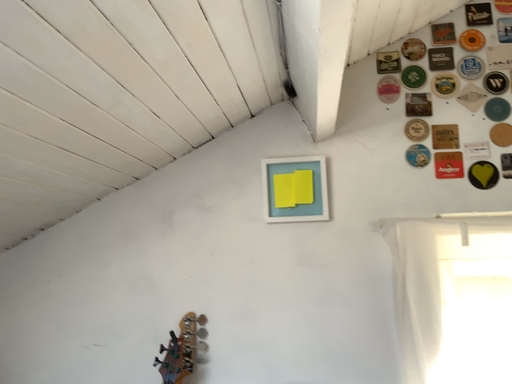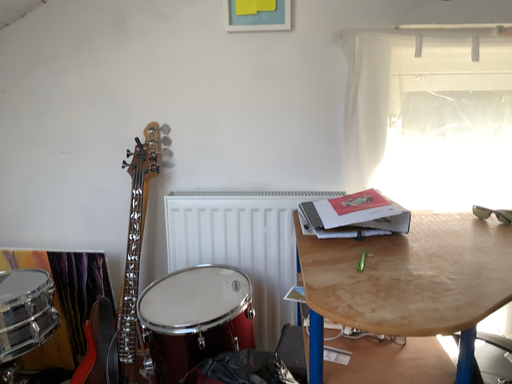
Question: How did the camera likely rotate when shooting the video?

Choices:
 (A) rotated upward
 (B) rotated downward

Answer: (B)